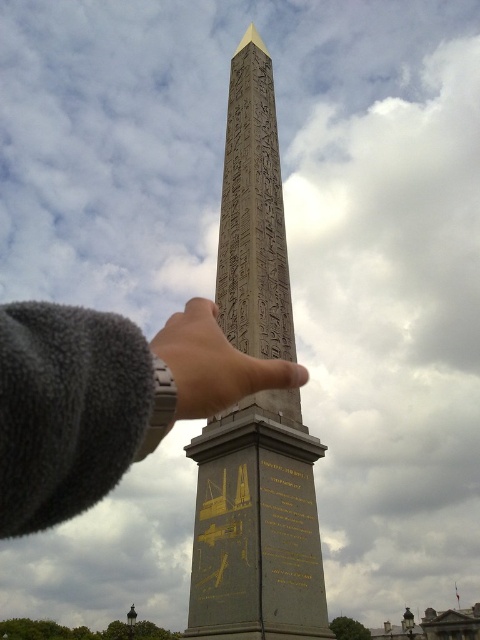
Is gray polished stone obelisk at center closer to camera compared to gray fleece finger at center?

No, it is behind gray fleece finger at center.

Can you confirm if gray polished stone obelisk at center is bigger than gray fleece finger at center?

Indeed, gray polished stone obelisk at center has a larger size compared to gray fleece finger at center.

The image size is (480, 640). What do you see at coordinates (256, 525) in the screenshot? I see `gray polished stone obelisk at center` at bounding box center [256, 525].

Image resolution: width=480 pixels, height=640 pixels. I want to click on gray polished stone obelisk at center, so click(256, 525).

Describe the element at coordinates (105, 400) in the screenshot. I see `gray fleece finger at center` at that location.

Between point (156, 381) and point (286, 360), which one is positioned in front?

Point (156, 381) is in front.

Describe the element at coordinates (105, 400) in the screenshot. This screenshot has width=480, height=640. I see `gray fleece finger at center` at that location.

You are a GUI agent. You are given a task and a screenshot of the screen. Output one action in this format:
    pyautogui.click(x=<x>, y=<y>)
    Task: Click on the gray fleece finger at center
    
    Given the screenshot: What is the action you would take?
    pyautogui.click(x=105, y=400)

Which of these two, gray polished stone obelisk at center or goldmaterial/textureinscription at center, stands taller?

gray polished stone obelisk at center

Is point (196, 586) closer to viewer compared to point (300, 577)?

No, it is not.

This screenshot has width=480, height=640. What do you see at coordinates (256, 525) in the screenshot?
I see `gray polished stone obelisk at center` at bounding box center [256, 525].

Where is `gray polished stone obelisk at center`? This screenshot has height=640, width=480. gray polished stone obelisk at center is located at coordinates (256, 525).